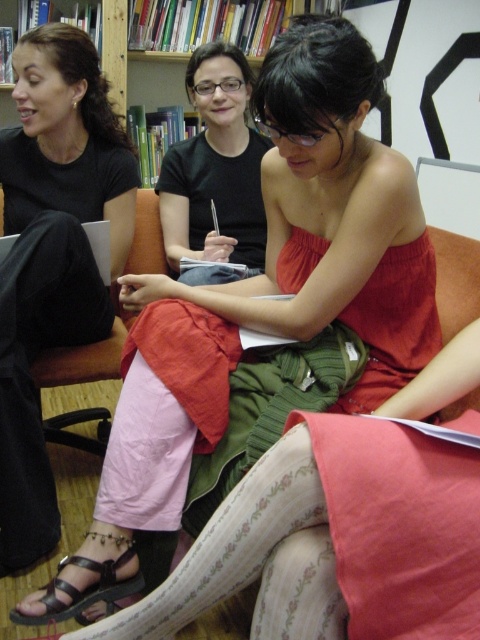
Is matte red dress at center to the right of black leather sandal at lower left from the viewer's perspective?

Indeed, matte red dress at center is positioned on the right side of black leather sandal at lower left.

Measure the distance from matte red dress at center to black leather sandal at lower left.

matte red dress at center and black leather sandal at lower left are 16.42 inches apart.

Where is `matte red dress at center`? This screenshot has height=640, width=480. matte red dress at center is located at coordinates (324, 371).

Where is `matte red dress at center`? The image size is (480, 640). matte red dress at center is located at coordinates (324, 371).

What do you see at coordinates (52, 256) in the screenshot? I see `pink fabric skirt at lower left` at bounding box center [52, 256].

Between point (36, 67) and point (62, 604), which one is positioned in front?

Positioned in front is point (62, 604).

Locate an element on the screen. The height and width of the screenshot is (640, 480). pink fabric skirt at lower left is located at coordinates (52, 256).

Is matte black shirt at center closer to camera compared to black leather sandal at lower left?

No, matte black shirt at center is behind black leather sandal at lower left.

Can you confirm if matte black shirt at center is thinner than black leather sandal at lower left?

No.

Image resolution: width=480 pixels, height=640 pixels. I want to click on matte black shirt at center, so click(x=215, y=168).